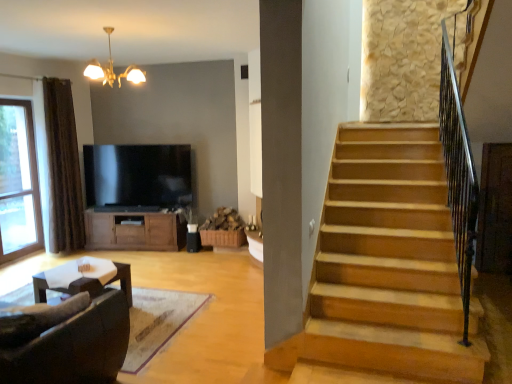
Question: Is gold metallic chandelier at upper center positioned before transparent glass window at left?

Choices:
 (A) yes
 (B) no

Answer: (A)

Question: From a real-world perspective, is gold metallic chandelier at upper center physically above transparent glass window at left?

Choices:
 (A) no
 (B) yes

Answer: (B)

Question: Can you confirm if gold metallic chandelier at upper center is thinner than transparent glass window at left?

Choices:
 (A) no
 (B) yes

Answer: (A)

Question: Can you confirm if gold metallic chandelier at upper center is positioned to the right of transparent glass window at left?

Choices:
 (A) no
 (B) yes

Answer: (B)

Question: From the image's perspective, is gold metallic chandelier at upper center over transparent glass window at left?

Choices:
 (A) no
 (B) yes

Answer: (B)

Question: Do you think brown wood cabinet at center is within transparent glass window at left, or outside of it?

Choices:
 (A) inside
 (B) outside

Answer: (B)

Question: From their relative heights in the image, would you say brown wood cabinet at center is taller or shorter than transparent glass window at left?

Choices:
 (A) short
 (B) tall

Answer: (A)

Question: Looking at the image, does brown wood cabinet at center seem bigger or smaller compared to transparent glass window at left?

Choices:
 (A) small
 (B) big

Answer: (B)

Question: Considering the relative positions of brown wood cabinet at center and transparent glass window at left in the image provided, is brown wood cabinet at center to the left or to the right of transparent glass window at left?

Choices:
 (A) left
 (B) right

Answer: (B)

Question: Relative to brown wood cabinet at center, is gold metallic chandelier at upper center in front or behind?

Choices:
 (A) behind
 (B) front

Answer: (B)

Question: From a real-world perspective, relative to brown wood cabinet at center, is gold metallic chandelier at upper center vertically above or below?

Choices:
 (A) above
 (B) below

Answer: (A)

Question: In the image, is gold metallic chandelier at upper center on the left side or the right side of brown wood cabinet at center?

Choices:
 (A) right
 (B) left

Answer: (A)

Question: Is gold metallic chandelier at upper center wider or thinner than brown wood cabinet at center?

Choices:
 (A) thin
 (B) wide

Answer: (B)

Question: In the image, is brown wood cabinet at center positioned in front of or behind brown fabric curtain at left?

Choices:
 (A) behind
 (B) front

Answer: (A)

Question: From the image's perspective, is brown wood cabinet at center located above or below brown fabric curtain at left?

Choices:
 (A) below
 (B) above

Answer: (A)